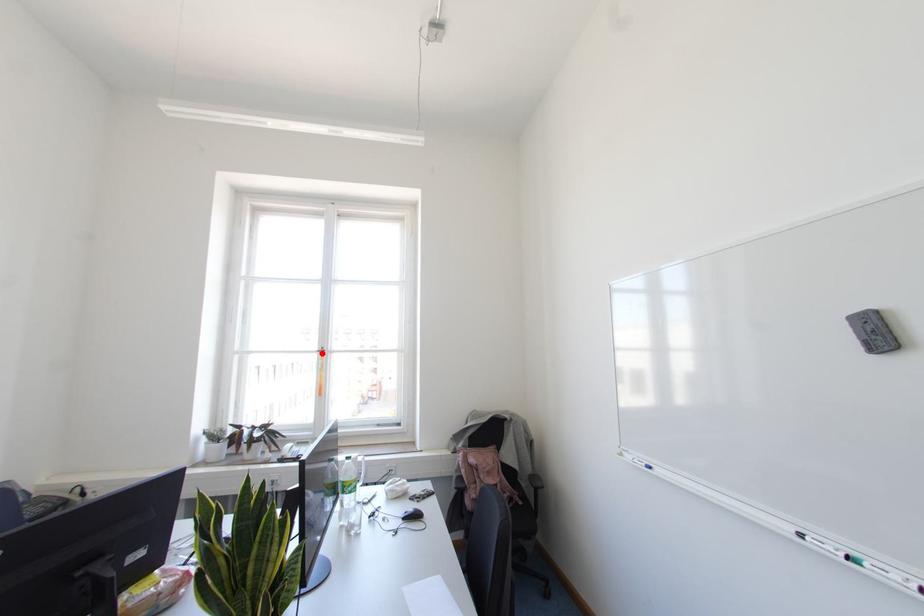
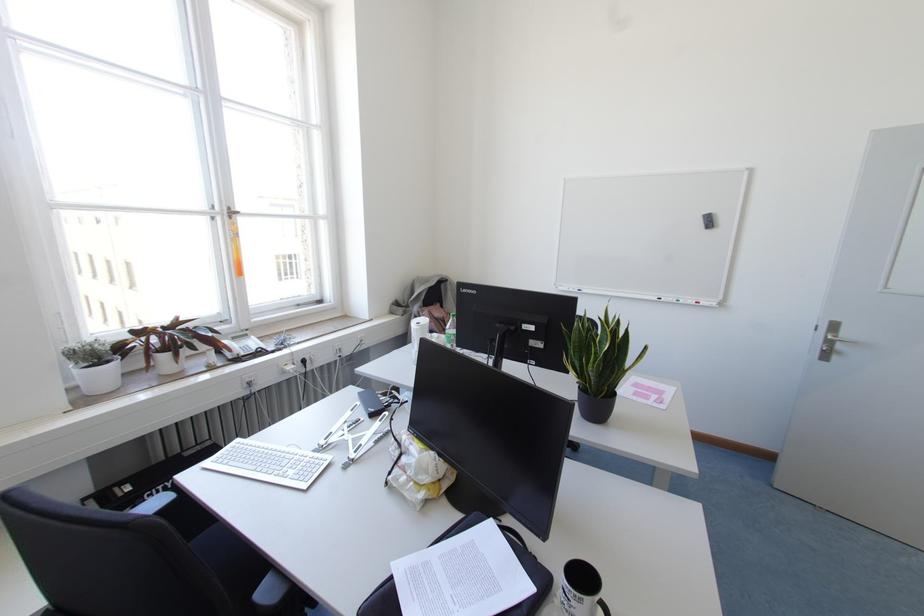
In the second image, find the point that corresponds to the highlighted location in the first image.

(229, 217)